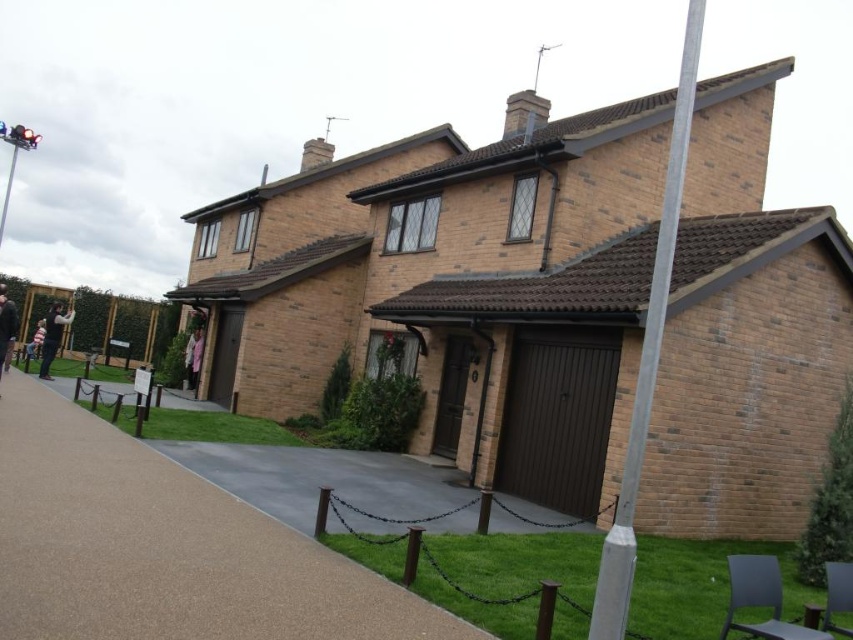
You are a delivery person trying to park your car in front of the house. You see the brown asphalt pavement at center and the silver metallic pole at upper right. Which object is directly above the parking area?

The silver metallic pole at upper right is directly above the brown asphalt pavement at center, which is the parking area.

You are a delivery person trying to park your 10 feet wide truck on the driveway. The brown asphalt pavement at center is where you plan to park. Considering the size of the silver metallic pole at upper right, will there be enough space for your truck to park without hitting the pole?

The brown asphalt pavement at center has a smaller size compared to the silver metallic pole at upper right. Since the truck is 10 feet wide, the pavement might not be wide enough to accommodate the truck safely without risking collision with the pole.

You are a delivery person approaching the house and need to park your vehicle. The parking spot is marked by the brown asphalt pavement at center. To ensure you don not hit the silver metallic pole at upper right, which side of the pole should you park on?

The brown asphalt pavement at center is positioned on the left side of the silver metallic pole at upper right, so you should park on the right side of the pole to avoid hitting it.